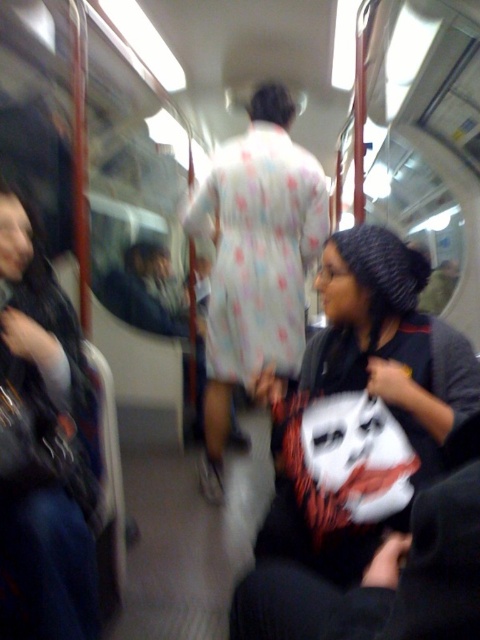
Is white printed shirt at center shorter than dark blue jeans at left?

Correct, white printed shirt at center is not as tall as dark blue jeans at left.

Does point (275, 596) lie behind point (27, 600)?

No, it is not.

The width and height of the screenshot is (480, 640). I want to click on white printed shirt at center, so click(x=368, y=397).